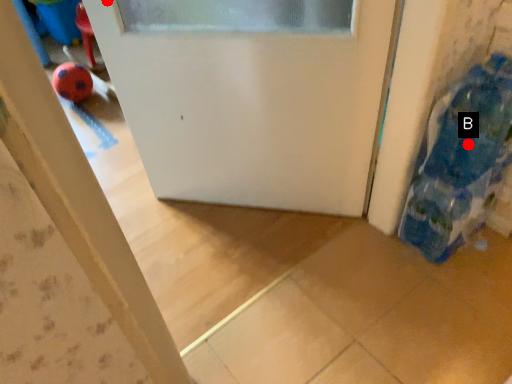
Question: Two points are circled on the image, labeled by A and B beside each circle. Which of the following is the closest to the observer?

Choices:
 (A) A is closer
 (B) B is closer

Answer: (A)